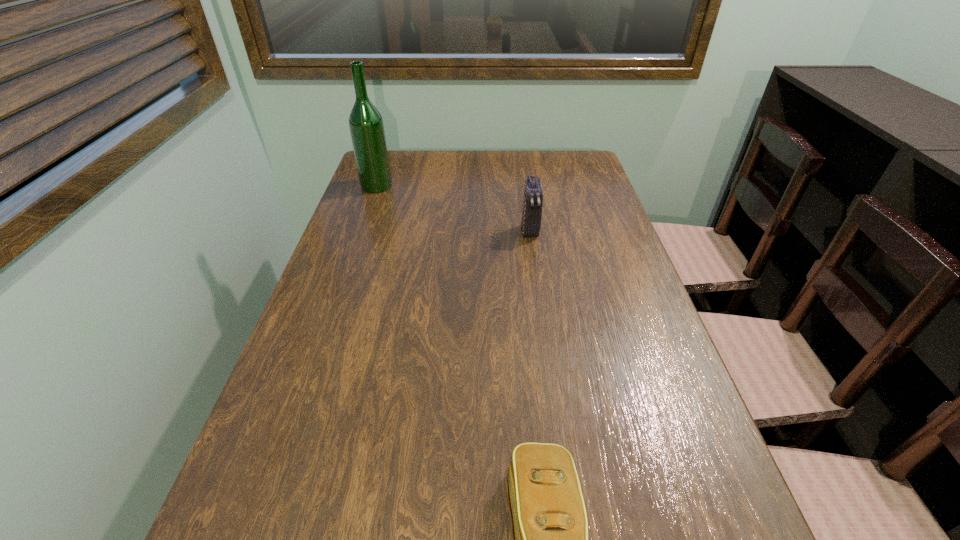
Locate an element on the screen. The image size is (960, 540). vacant space at the left edge of the desktop is located at coordinates (348, 239).

In the image, there is a desktop. Identify the location of vacant region at the right edge. The image size is (960, 540). (646, 437).

The width and height of the screenshot is (960, 540). In the image, there is a desktop. Identify the location of vacant space at the far left corner. (393, 151).

This screenshot has height=540, width=960. In order to click on vacant space at the far right corner of the desktop in this screenshot , I will do `click(571, 160)`.

I want to click on unoccupied area between the leftmost object and the second farthest object, so click(x=453, y=208).

You are a GUI agent. You are given a task and a screenshot of the screen. Output one action in this format:
    pyautogui.click(x=<x>, y=<y>)
    Task: Click on the free spot between the farthest object and the farther clutch bag
    This screenshot has width=960, height=540.
    Given the screenshot: What is the action you would take?
    pyautogui.click(x=453, y=208)

The width and height of the screenshot is (960, 540). Identify the location of free space between the leftmost object and the taller clutch bag. (453, 208).

Find the location of `free space between the farther clutch bag and the alcohol`. free space between the farther clutch bag and the alcohol is located at coordinates (453, 208).

Select which object is the second closest to the nearest object. Please provide its 2D coordinates. Your answer should be formatted as a tuple, i.e. [(x, y)], where the tuple contains the x and y coordinates of a point satisfying the conditions above.

[(366, 125)]

Identify which object is the second closest to the taller clutch bag. Please provide its 2D coordinates. Your answer should be formatted as a tuple, i.e. [(x, y)], where the tuple contains the x and y coordinates of a point satisfying the conditions above.

[(550, 522)]